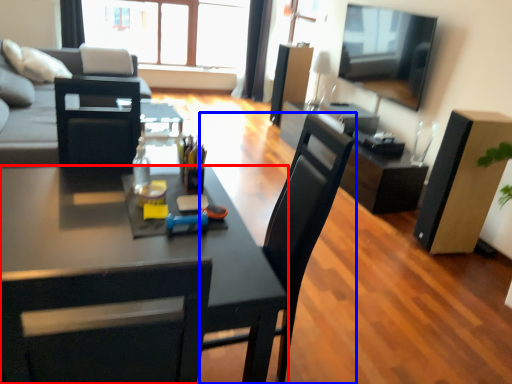
Question: Which object appears closest to the camera in this image, desk (highlighted by a red box) or chair (highlighted by a blue box)?

Choices:
 (A) desk
 (B) chair

Answer: (A)